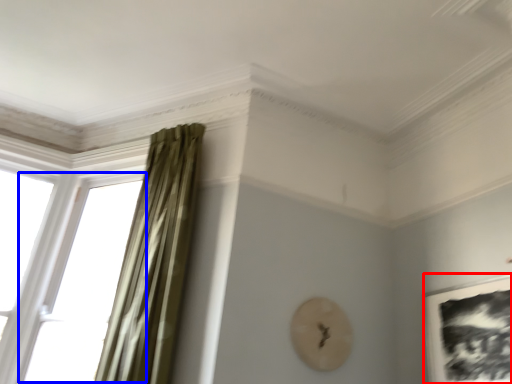
Question: Which object is further to the camera taking this photo, picture frame (highlighted by a red box) or window (highlighted by a blue box)?

Choices:
 (A) picture frame
 (B) window

Answer: (B)